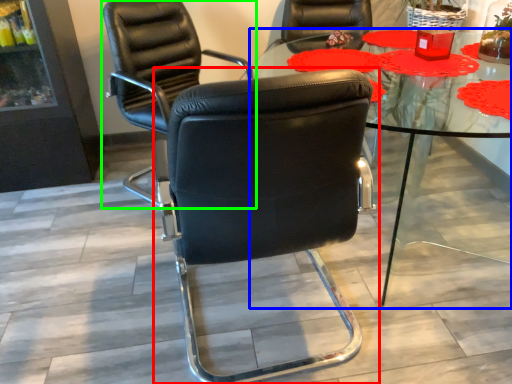
Question: Which object is positioned farthest from chair (highlighted by a red box)? Select from table (highlighted by a blue box) and chair (highlighted by a green box).

Choices:
 (A) table
 (B) chair

Answer: (B)